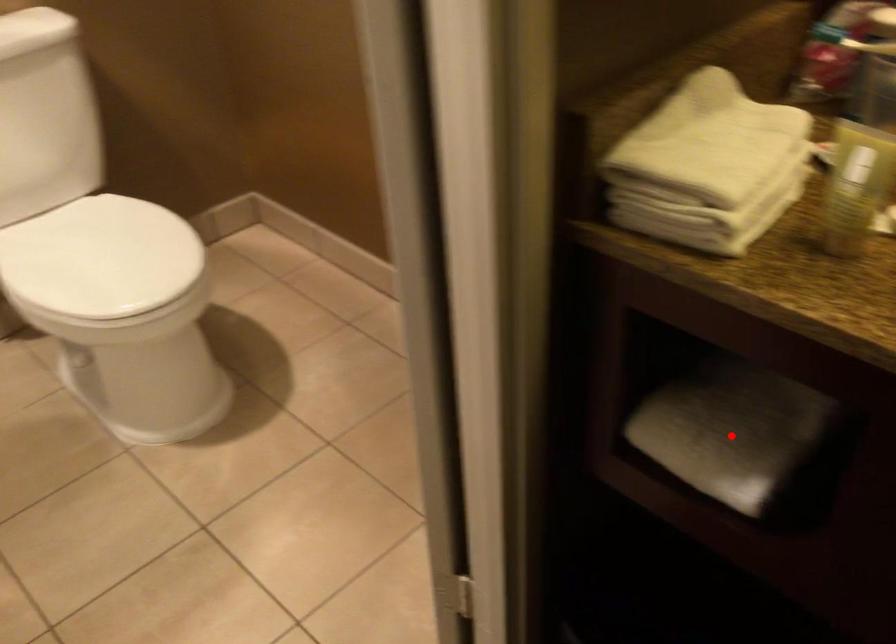
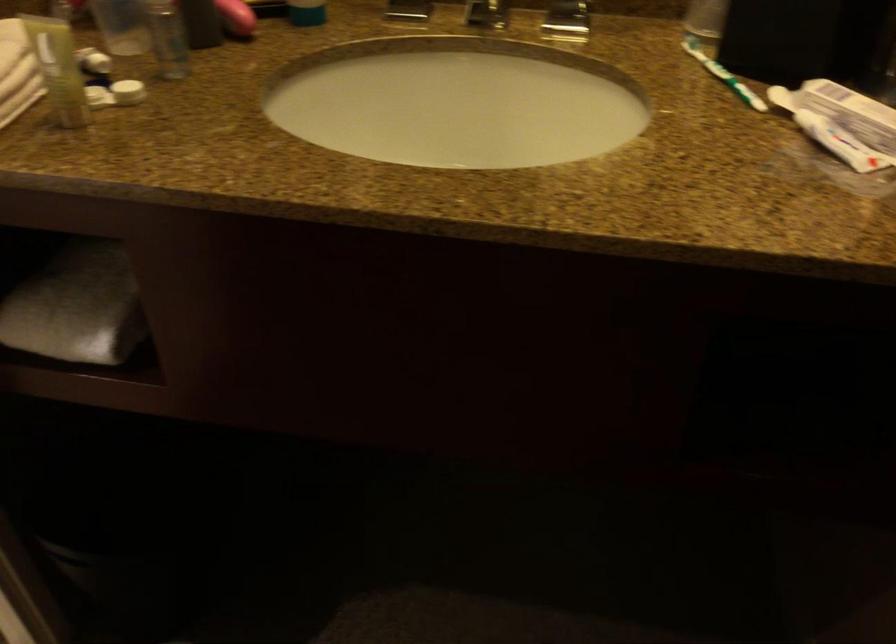
In the second image, find the point that corresponds to the highlighted location in the first image.

(76, 306)